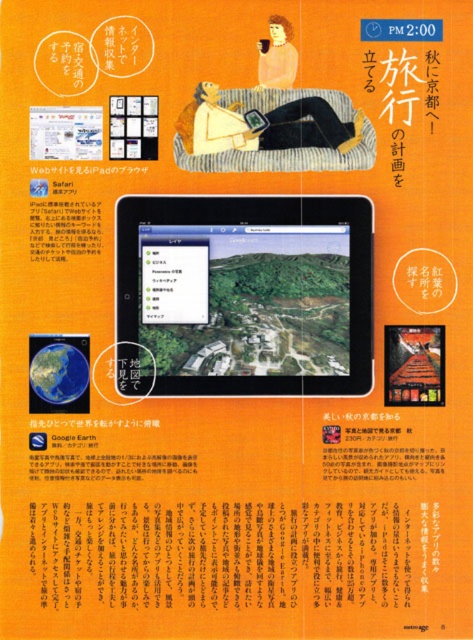
Can you confirm if black glossy tablet at center is smaller than orange paper at upper center?

Yes, black glossy tablet at center is smaller than orange paper at upper center.

Which is above, black glossy tablet at center or orange paper at upper center?

black glossy tablet at center

Image resolution: width=473 pixels, height=640 pixels. Describe the element at coordinates (244, 296) in the screenshot. I see `black glossy tablet at center` at that location.

Where is `black glossy tablet at center`? This screenshot has width=473, height=640. black glossy tablet at center is located at coordinates (244, 296).

Which of these two, orange paper at upper center or matte black tablet at center, stands taller?

With more height is orange paper at upper center.

Who is more forward, (x=387, y=564) or (x=227, y=138)?

Positioned in front is point (x=387, y=564).

Does point (140, 564) come closer to viewer compared to point (204, 154)?

Yes, it is.

I want to click on orange paper at upper center, so click(x=228, y=554).

Does orange paper at upper center appear on the right side of pastel yellow hair at upper center?

Incorrect, orange paper at upper center is not on the right side of pastel yellow hair at upper center.

Is orange paper at upper center closer to the viewer compared to pastel yellow hair at upper center?

That is True.

The width and height of the screenshot is (473, 640). What do you see at coordinates (228, 554) in the screenshot? I see `orange paper at upper center` at bounding box center [228, 554].

At what (x,y) coordinates should I click in order to perform the action: click on orange paper at upper center. Please return your answer as a coordinate pair (x, y). The width and height of the screenshot is (473, 640). Looking at the image, I should click on (228, 554).